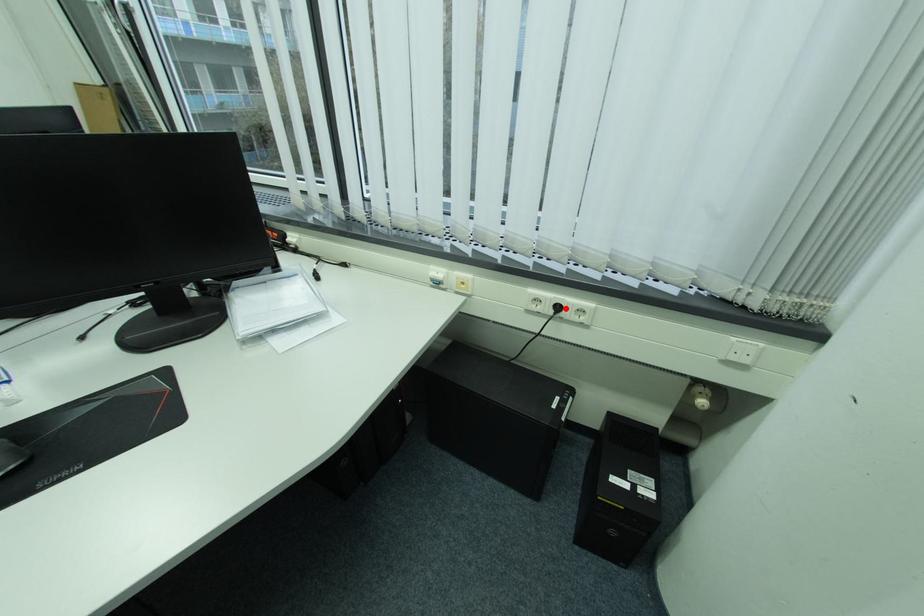
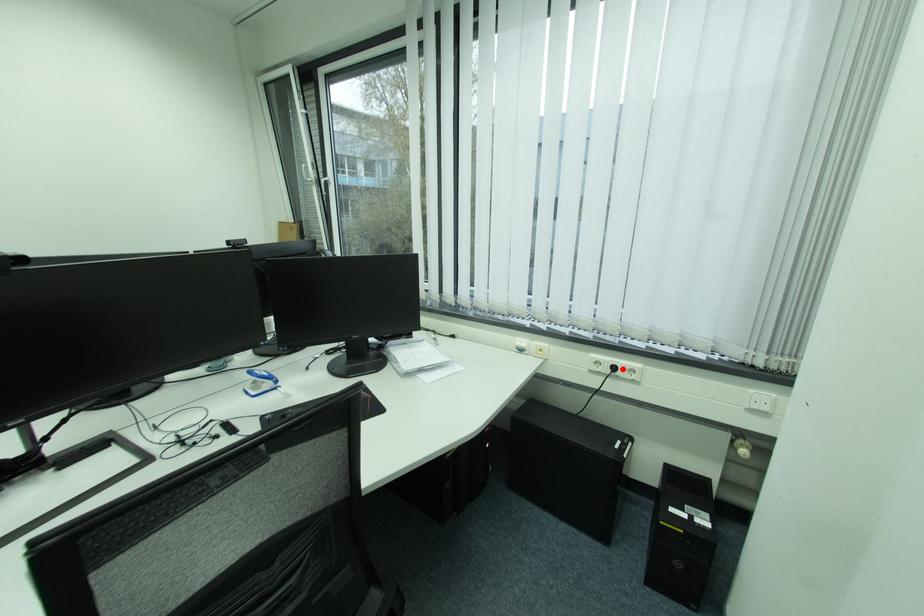
I am providing you with two images of the same scene from different viewpoints. A red point is marked on the first image and another point is marked on the second image. Do the highlighted points in image1 and image2 indicate the same real-world spot?

Yes